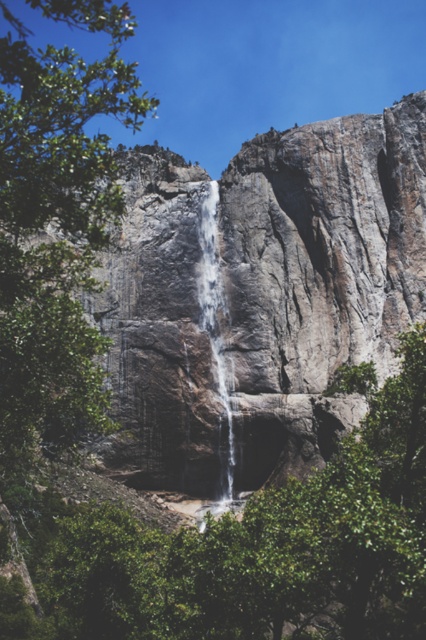
You are a hiker standing at the base of the waterfall. You notice a green leafy tree at center and clear water at center. Which object is positioned to the right side of the other?

The green leafy tree at center is to the right of clear water at center.

You are a photographer planning to capture the waterfall and its surroundings. You notice the green leafy tree at center and the clear water at center. Which object should you focus on if you want to highlight the larger subject in your photo?

The green leafy tree at center is bigger than the clear water at center, so you should focus on the green leafy tree at center to highlight the larger subject in your photo.

You are a hiker standing at the edge of the cliff overlooking the waterfall. You notice a green leafy tree at center and clear water at center. Which object is wider from your perspective?

The green leafy tree at center might be wider than clear water at center.